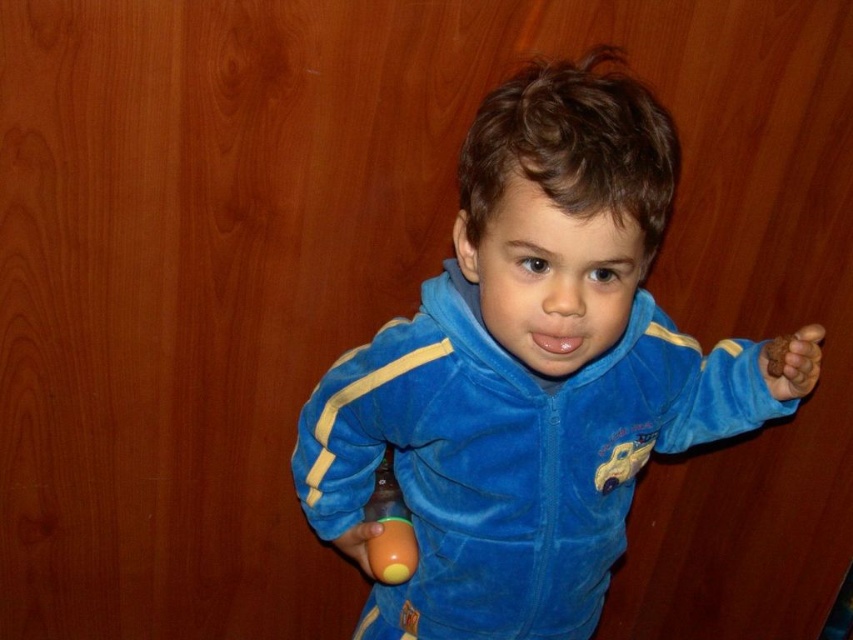
Question: Among these points, which one is farthest from the camera?

Choices:
 (A) (810, 352)
 (B) (575, 348)

Answer: (A)

Question: Considering the relative positions of velvet blue tracksuit at center and matte orange ball at lower center in the image provided, where is velvet blue tracksuit at center located with respect to matte orange ball at lower center?

Choices:
 (A) right
 (B) left

Answer: (A)

Question: Which of these objects is positioned closest to the matte orange ball at lower center?

Choices:
 (A) orange rubber ball at lower center
 (B) velvet blue tracksuit at center

Answer: (A)

Question: Can you confirm if velvet blue tracksuit at center is positioned above orange rubber ball at lower center?

Choices:
 (A) yes
 (B) no

Answer: (A)

Question: Does orange rubber ball at lower center appear under matte orange ball at lower center?

Choices:
 (A) no
 (B) yes

Answer: (A)

Question: Which of the following is the closest to the observer?

Choices:
 (A) (341, 547)
 (B) (418, 330)

Answer: (B)